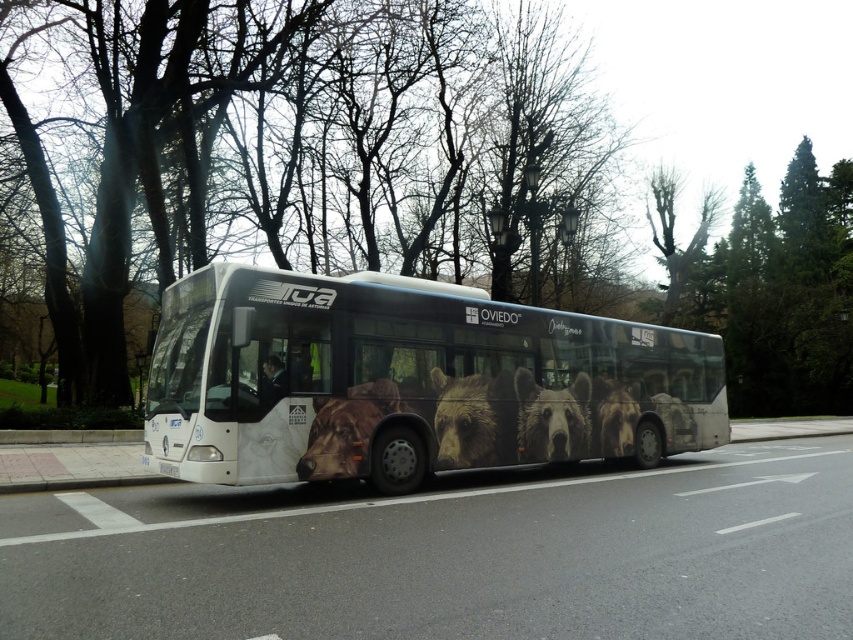
Question: Which of the following is the closest to the observer?

Choices:
 (A) white plastic license plate at lower center
 (B) green leafy tree at center
 (C) white metallic bus at center

Answer: (C)

Question: Can you confirm if green leafy tree at center is positioned to the left of white plastic license plate at lower center?

Choices:
 (A) yes
 (B) no

Answer: (B)

Question: Is white metallic bus at center wider than white plastic license plate at lower center?

Choices:
 (A) yes
 (B) no

Answer: (A)

Question: Which object appears farthest from the camera in this image?

Choices:
 (A) green leafy tree at center
 (B) white metallic bus at center

Answer: (A)

Question: Which object is the farthest from the white metallic bus at center?

Choices:
 (A) white plastic license plate at lower center
 (B) green leafy tree at center

Answer: (B)

Question: Is green leafy tree at center thinner than white plastic license plate at lower center?

Choices:
 (A) yes
 (B) no

Answer: (B)